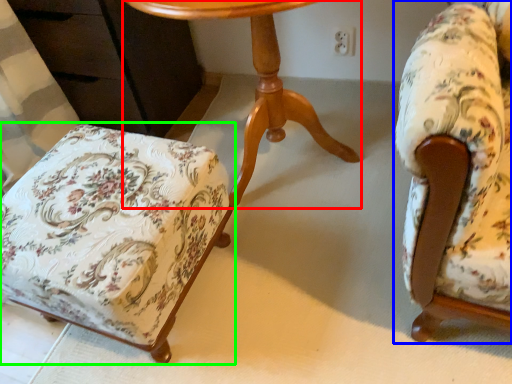
Question: Estimate the real-world distances between objects in this image. Which object is closer to table (highlighted by a red box), chair (highlighted by a blue box) or chair (highlighted by a green box)?

Choices:
 (A) chair
 (B) chair

Answer: (B)